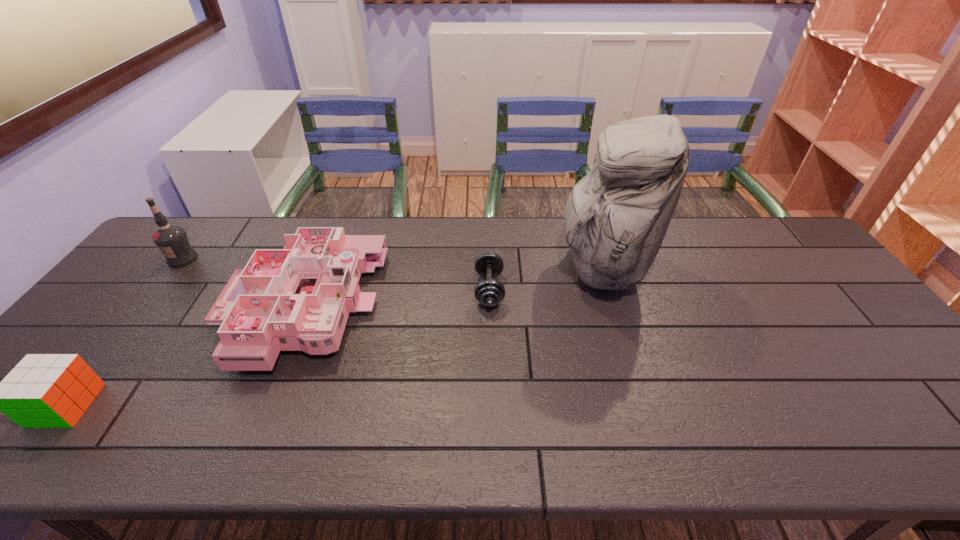
At what (x,y) coordinates should I click in order to perform the action: click on object positioned at the far left corner. Please return your answer as a coordinate pair (x, y). The width and height of the screenshot is (960, 540). Looking at the image, I should click on (171, 239).

This screenshot has width=960, height=540. In order to click on object at the near left corner in this screenshot , I will do (x=43, y=390).

In the image, there is a desktop. Where is `vacant space at the far edge`? The height and width of the screenshot is (540, 960). vacant space at the far edge is located at coordinates (758, 256).

What are the coordinates of `vacant region at the near edge of the desktop` in the screenshot? It's located at (316, 436).

You are a GUI agent. You are given a task and a screenshot of the screen. Output one action in this format:
    pyautogui.click(x=<x>, y=<y>)
    Task: Click on the vacant space at the left edge of the desktop
    
    Given the screenshot: What is the action you would take?
    pyautogui.click(x=168, y=267)

Locate an element on the screen. This screenshot has height=540, width=960. vacant space at the right edge of the desktop is located at coordinates (879, 377).

The height and width of the screenshot is (540, 960). Identify the location of free space at the far right corner. (775, 230).

You are a GUI agent. You are given a task and a screenshot of the screen. Output one action in this format:
    pyautogui.click(x=<x>, y=<y>)
    Task: Click on the free space at the near right corner
    This screenshot has width=960, height=540.
    Given the screenshot: What is the action you would take?
    pyautogui.click(x=953, y=444)

Where is `empty location between the shortest object and the dollhouse`? empty location between the shortest object and the dollhouse is located at coordinates (395, 298).

Locate an element on the screen. The image size is (960, 540). free area in between the cube and the fourth shortest object is located at coordinates (124, 332).